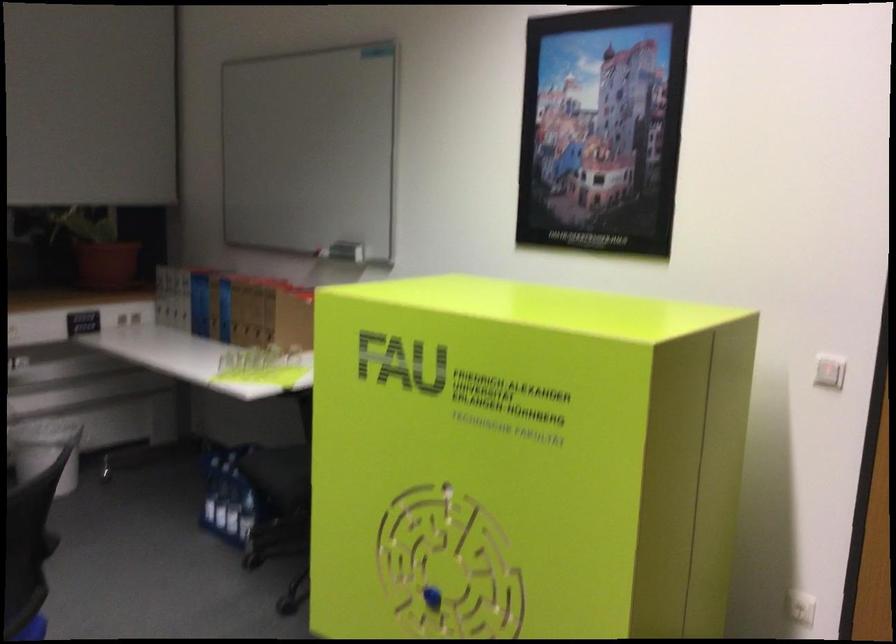
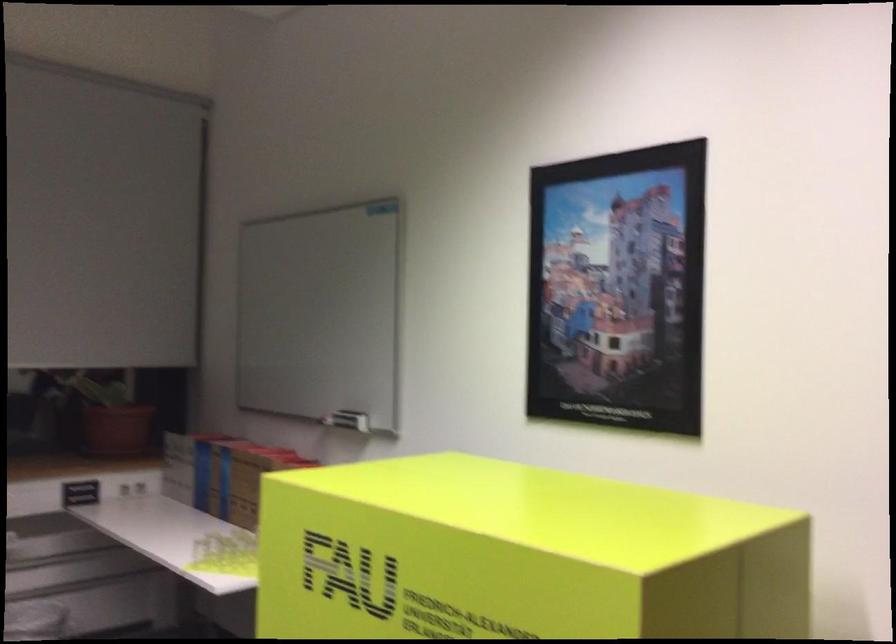
Question: The images are taken continuously from a first-person perspective. In which direction is your viewpoint rotating?

Choices:
 (A) Left
 (B) Right
 (C) Up
 (D) Down

Answer: (C)